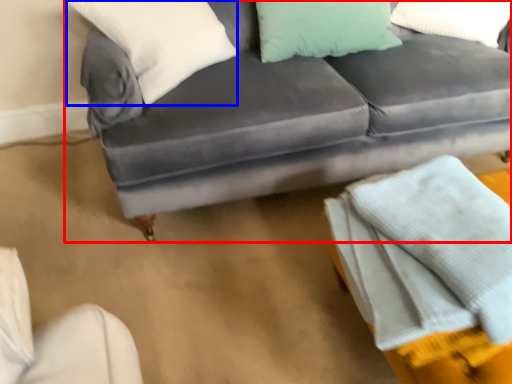
Question: Which object is further to the camera taking this photo, studio couch (highlighted by a red box) or pillow (highlighted by a blue box)?

Choices:
 (A) studio couch
 (B) pillow

Answer: (B)